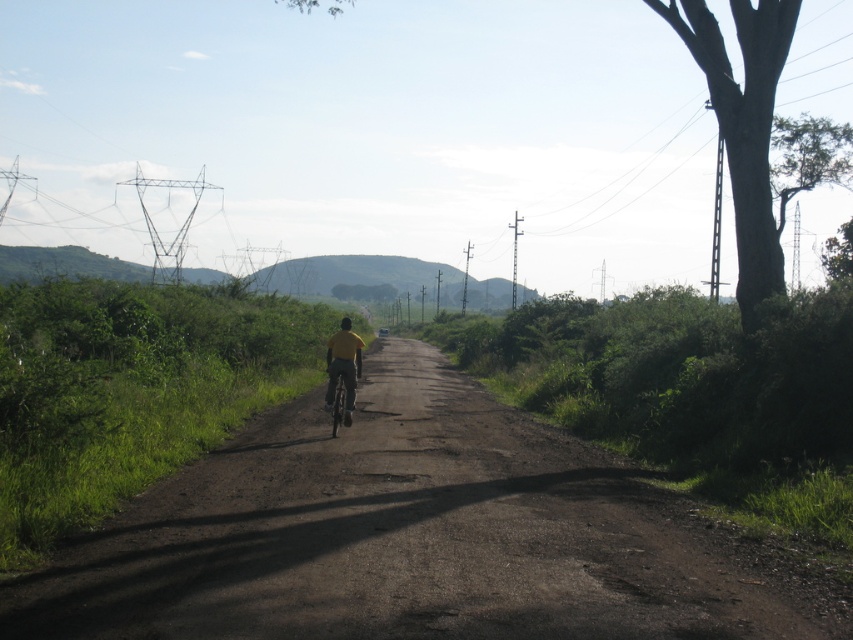
You are a photographer planning to capture the entire dirt road at center and metallic silver bicycle at center in a single shot. Given that the bicycle is smaller than the road, how can you position your camera to ensure both are fully visible?

Since the dirt road at center is larger than the metallic silver bicycle at center, you can position your camera further back to capture the entire dirt road at center while still including the metallic silver bicycle at center in the frame.

You are a delivery person riding a bicycle on the dirt road at center. You need to place a package on the yellow fabric at center. Can you reach it without dismounting from the bicycle?

The dirt road at center is 2.95 meters from the yellow fabric at center. Since the distance is too far to reach while riding the bicycle, you would need to dismount to place the package on the yellow fabric at center.